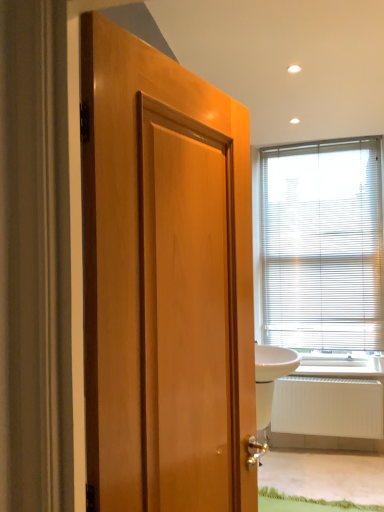
Identify the location of free space above white matte radiator at lower right (from a real-world perspective). (329, 379).